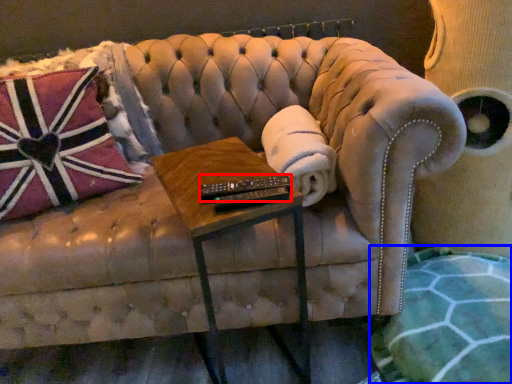
Question: Which point is further to the camera, control (highlighted by a red box) or blanket (highlighted by a blue box)?

Choices:
 (A) control
 (B) blanket

Answer: (A)